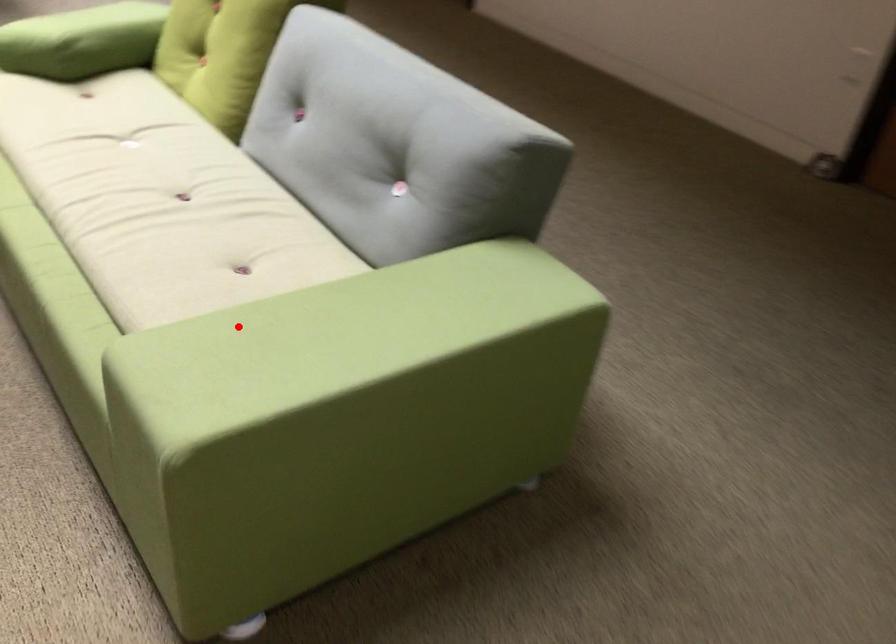
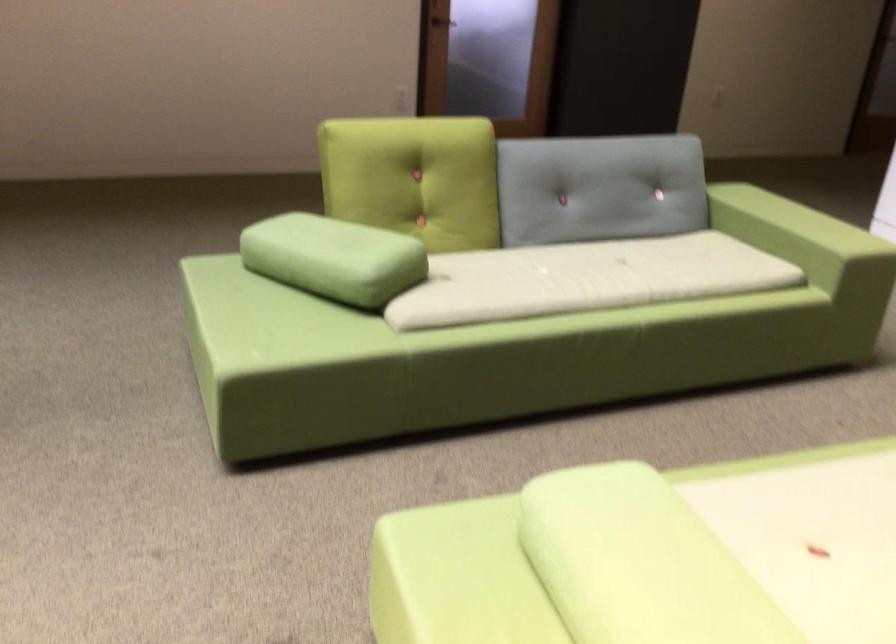
Where in the second image is the point corresponding to the highlighted location from the first image?

(794, 241)